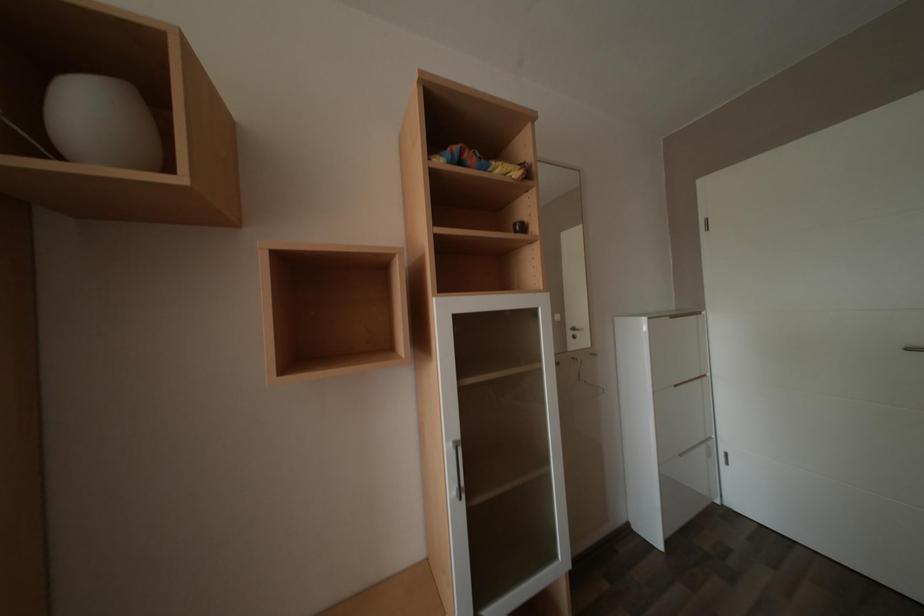
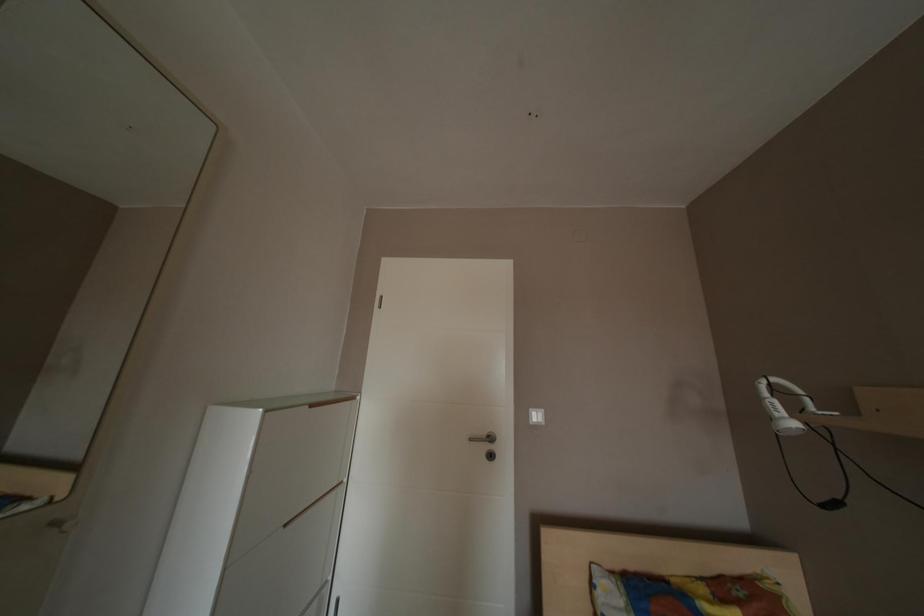
In the scene shown: Based on the continuous images, in which direction is the camera rotating?

The camera rotated toward right-up.